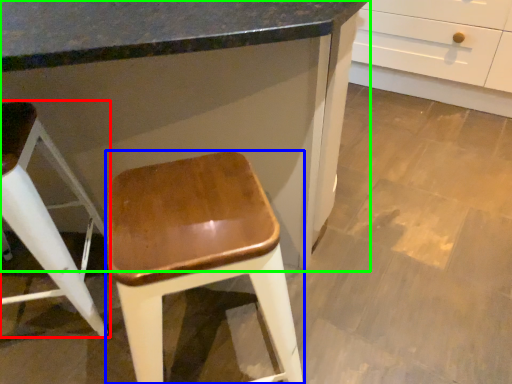
Question: Which object is positioned farthest from stool (highlighted by a red box)? Select from stool (highlighted by a blue box) and cabinetry (highlighted by a green box).

Choices:
 (A) stool
 (B) cabinetry

Answer: (A)